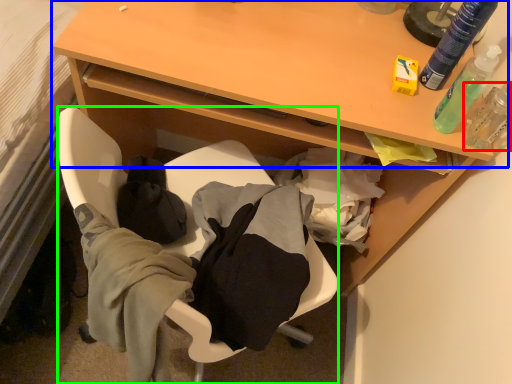
Question: Which is farther away from toiletry (highlighted by a red box)? table (highlighted by a blue box) or chair (highlighted by a green box)?

Choices:
 (A) table
 (B) chair

Answer: (B)